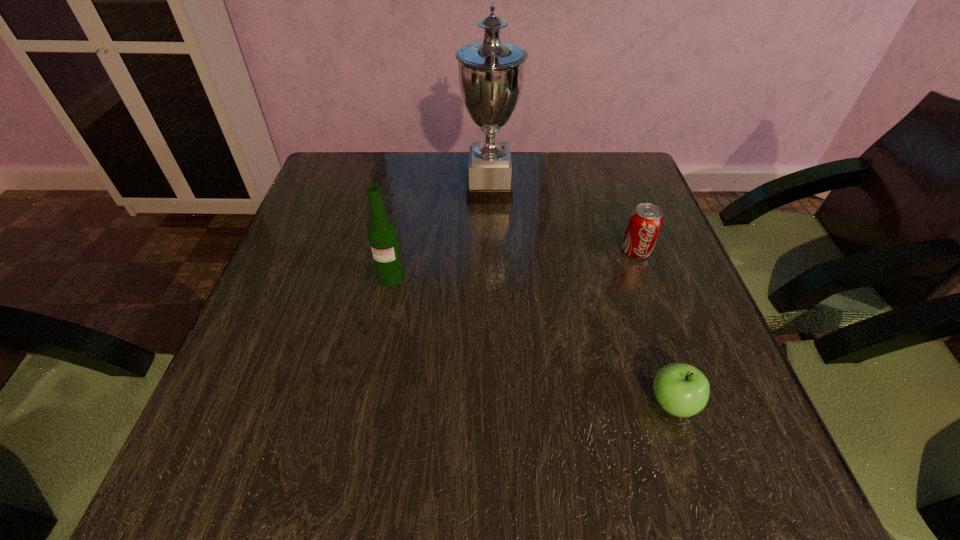
Where is `trophy cup`? trophy cup is located at coordinates (491, 73).

This screenshot has width=960, height=540. What are the coordinates of `the farthest object` in the screenshot? It's located at (491, 73).

At what (x,y) coordinates should I click in order to perform the action: click on beer bottle. Please return your answer as a coordinate pair (x, y). Image resolution: width=960 pixels, height=540 pixels. Looking at the image, I should click on (382, 234).

I want to click on the third shortest object, so click(382, 234).

You are a GUI agent. You are given a task and a screenshot of the screen. Output one action in this format:
    pyautogui.click(x=<x>, y=<y>)
    Task: Click on the third tallest object
    
    Given the screenshot: What is the action you would take?
    pyautogui.click(x=645, y=222)

The width and height of the screenshot is (960, 540). Identify the location of soda. (645, 222).

The height and width of the screenshot is (540, 960). Identify the location of apple. (682, 390).

The width and height of the screenshot is (960, 540). I want to click on the shortest object, so click(x=682, y=390).

At what (x,y) coordinates should I click in order to perform the action: click on vacant space located 0.310m at the front view of the second object from left to right. Please return your answer as a coordinate pair (x, y). Looking at the image, I should click on (342, 190).

In order to click on blank area located at the front view of the second object from left to right in this screenshot , I will do `click(419, 190)`.